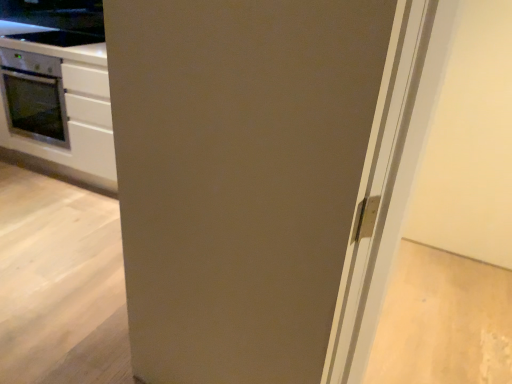
Question: Can you confirm if matte gray door at center is bigger than smooth black countertop at upper left?

Choices:
 (A) yes
 (B) no

Answer: (A)

Question: Is matte gray door at center completely or partially outside of smooth black countertop at upper left?

Choices:
 (A) yes
 (B) no

Answer: (A)

Question: Is smooth black countertop at upper left inside matte gray door at center?

Choices:
 (A) yes
 (B) no

Answer: (B)

Question: Does matte gray door at center turn towards smooth black countertop at upper left?

Choices:
 (A) no
 (B) yes

Answer: (A)

Question: Is matte gray door at center oriented away from smooth black countertop at upper left?

Choices:
 (A) yes
 (B) no

Answer: (B)

Question: Choose the correct answer: Is smooth black countertop at upper left inside matte gray door at center or outside it?

Choices:
 (A) outside
 (B) inside

Answer: (A)

Question: Is point (56, 46) positioned closer to the camera than point (300, 206)?

Choices:
 (A) closer
 (B) farther

Answer: (B)

Question: From a real-world perspective, is smooth black countertop at upper left above or below matte gray door at center?

Choices:
 (A) above
 (B) below

Answer: (A)

Question: Considering the relative positions of smooth black countertop at upper left and matte gray door at center in the image provided, is smooth black countertop at upper left to the left or to the right of matte gray door at center?

Choices:
 (A) right
 (B) left

Answer: (B)

Question: In the image, is smooth black countertop at upper left on the left side or the right side of white glossy cabinet at left?

Choices:
 (A) left
 (B) right

Answer: (B)

Question: In the image, is smooth black countertop at upper left positioned in front of or behind white glossy cabinet at left?

Choices:
 (A) behind
 (B) front

Answer: (A)

Question: Considering the positions of smooth black countertop at upper left and white glossy cabinet at left in the image, is smooth black countertop at upper left taller or shorter than white glossy cabinet at left?

Choices:
 (A) tall
 (B) short

Answer: (B)

Question: Is smooth black countertop at upper left inside the boundaries of white glossy cabinet at left, or outside?

Choices:
 (A) outside
 (B) inside

Answer: (A)

Question: From the image's perspective, is matte gray door at center positioned above or below smooth black countertop at upper left?

Choices:
 (A) above
 (B) below

Answer: (B)

Question: Visually, is matte gray door at center positioned to the left or to the right of smooth black countertop at upper left?

Choices:
 (A) left
 (B) right

Answer: (B)